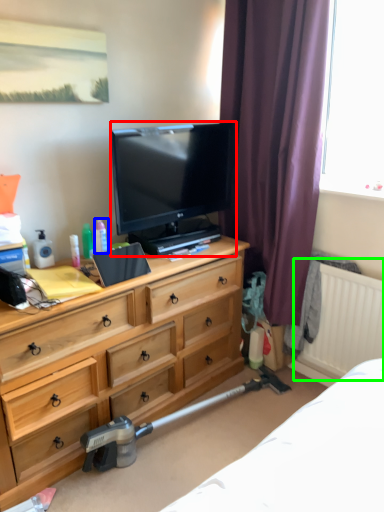
Question: Which object is positioned farthest from television (highlighted by a red box)? Select from toiletry (highlighted by a blue box) and radiator (highlighted by a green box).

Choices:
 (A) toiletry
 (B) radiator

Answer: (B)